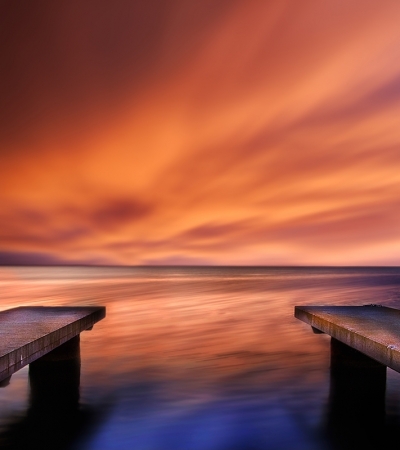
Locate an element on the screen. This screenshot has width=400, height=450. gallary art is located at coordinates (282, 355).